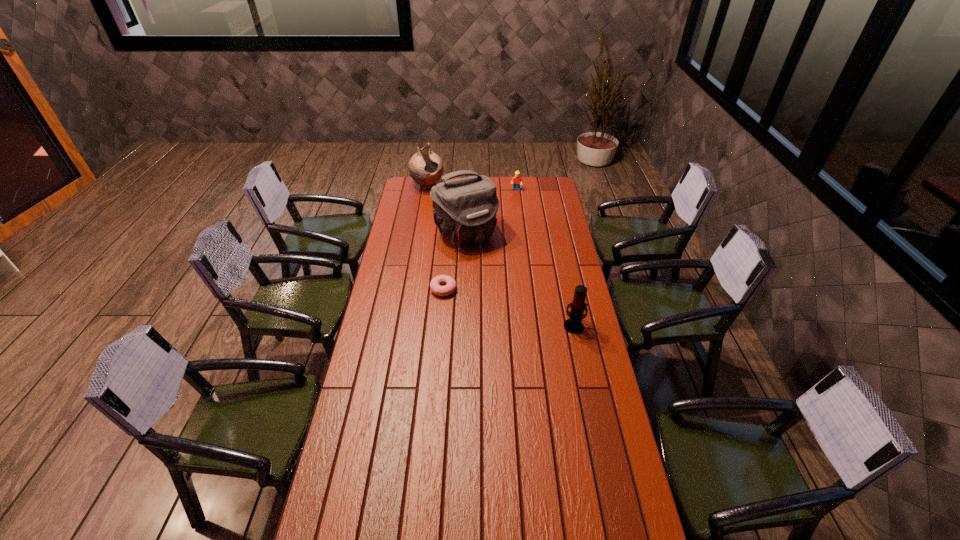
The height and width of the screenshot is (540, 960). Find the location of `free space on the desktop that is between the second nearest object and the rightmost object and is positioned on the open flap of the third nearest object`. free space on the desktop that is between the second nearest object and the rightmost object and is positioned on the open flap of the third nearest object is located at coordinates (524, 312).

This screenshot has height=540, width=960. Identify the location of vacant spot on the desktop that is between the doughnut and the microphone and is positioned on the face of the Lego. (492, 303).

This screenshot has height=540, width=960. What are the coordinates of `free spot on the desktop that is between the second nearest object and the third tallest object and is positioned from the spout of the pottery` in the screenshot? It's located at (524, 312).